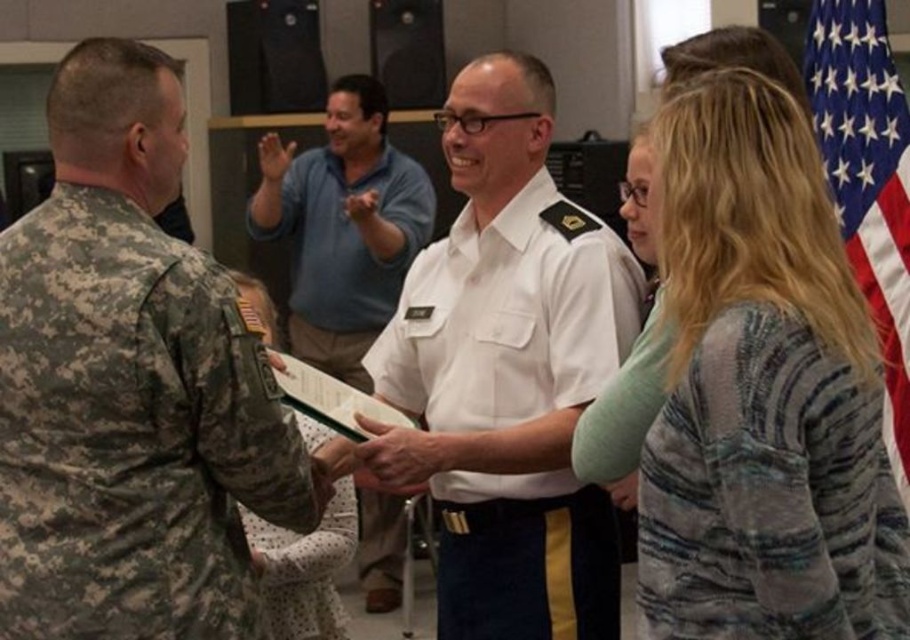
Question: Which point appears closest to the camera in this image?

Choices:
 (A) (857, 180)
 (B) (710, 452)

Answer: (B)

Question: Which object appears farthest from the camera in this image?

Choices:
 (A) striped sweater at center
 (B) red fabric flag at right
 (C) camouflage uniform at left
 (D) smooth white paper at center

Answer: (B)

Question: Does white uniform at center have a greater width compared to red fabric flag at right?

Choices:
 (A) yes
 (B) no

Answer: (A)

Question: Which object appears farthest from the camera in this image?

Choices:
 (A) white uniform at center
 (B) striped sweater at center
 (C) smooth white paper at center
 (D) white uniform shirt at center

Answer: (D)

Question: Is the position of camouflage uniform at left less distant than that of white uniform at center?

Choices:
 (A) yes
 (B) no

Answer: (A)

Question: Is striped sweater at center positioned before smooth white paper at center?

Choices:
 (A) no
 (B) yes

Answer: (B)